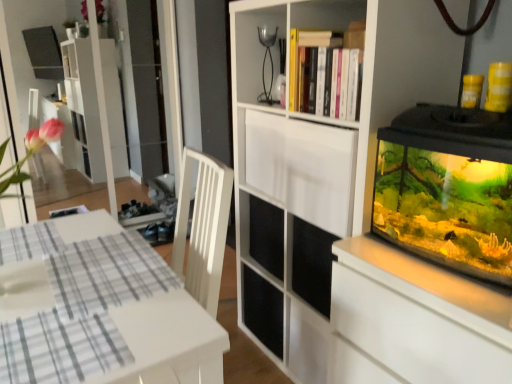
The width and height of the screenshot is (512, 384). What do you see at coordinates (165, 341) in the screenshot? I see `white glossy table at lower left` at bounding box center [165, 341].

At what (x,y) coordinates should I click in order to perform the action: click on white matte cupboard at center. Please return your answer as a coordinate pair (x, y). The width and height of the screenshot is (512, 384). Looking at the image, I should click on (356, 212).

Where is `white glossy table at lower left`? The height and width of the screenshot is (384, 512). white glossy table at lower left is located at coordinates (165, 341).

Based on their positions, is white glossy table at lower left located to the left or right of white matte cupboard at center?

From the image, it's evident that white glossy table at lower left is to the left of white matte cupboard at center.

From a real-world perspective, relative to white matte cupboard at center, is white glossy table at lower left vertically above or below?

From a real-world perspective, white glossy table at lower left is physically below white matte cupboard at center.

Considering the relative sizes of white glossy table at lower left and white matte cupboard at center in the image provided, is white glossy table at lower left taller than white matte cupboard at center?

In fact, white glossy table at lower left may be shorter than white matte cupboard at center.

Is white glossy table at lower left not within white matte cupboard at center?

That's correct, white glossy table at lower left is outside of white matte cupboard at center.

Based on their positions, is white matte cupboard at center located to the left or right of white glossy table at lower left?

Based on their positions, white matte cupboard at center is located to the right of white glossy table at lower left.

Where is `cupboard above the white glossy table at lower left (from the image's perspective)`? This screenshot has width=512, height=384. cupboard above the white glossy table at lower left (from the image's perspective) is located at coordinates (356, 212).

In the image, is white matte cupboard at center positioned in front of or behind white glossy table at lower left?

white matte cupboard at center is behind white glossy table at lower left.

Looking at their sizes, would you say white matte cupboard at center is wider or thinner than white glossy table at lower left?

white matte cupboard at center is thinner than white glossy table at lower left.

Between white matte cupboard at center and white matte cabinet at upper center, which one has larger size?

white matte cupboard at center is bigger.

Looking at their sizes, would you say white matte cupboard at center is wider or thinner than white matte cabinet at upper center?

Considering their sizes, white matte cupboard at center looks broader than white matte cabinet at upper center.

Is the depth of white matte cupboard at center greater than that of white matte cabinet at upper center?

No, white matte cupboard at center is closer to the camera.

Is point (372, 328) positioned before point (265, 167)?

Yes, point (372, 328) is in front of point (265, 167).

Does white matte cabinet at upper center have a lesser height compared to white glossy table at lower left?

Yes, white matte cabinet at upper center is shorter than white glossy table at lower left.

Based on the photo, is white matte cabinet at upper center oriented away from white glossy table at lower left?

That's not correct — white matte cabinet at upper center is not looking away from white glossy table at lower left.

Locate an element on the screen. This screenshot has height=384, width=512. table that appears below the white matte cabinet at upper center (from the image's perspective) is located at coordinates (165, 341).

How many degrees apart are the facing directions of white matte cabinet at upper center and white glossy table at lower left?

2.77 degrees.

Which point is more distant from viewer, (267, 142) or (369, 374)?

The point (267, 142) is farther from the camera.

From the image's perspective, which is above, white matte cabinet at upper center or white matte cupboard at center?

white matte cabinet at upper center.

Is white matte cabinet at upper center with white matte cupboard at center?

No, white matte cabinet at upper center is not in contact with white matte cupboard at center.

Is white glossy table at lower left positioned far away from white matte cabinet at upper center?

Actually, white glossy table at lower left and white matte cabinet at upper center are a little close together.

Where is `cabinetry that is above the white glossy table at lower left (from the image's perspective)`? This screenshot has width=512, height=384. cabinetry that is above the white glossy table at lower left (from the image's perspective) is located at coordinates (303, 168).

Considering the points (192, 354) and (303, 200), which point is behind, point (192, 354) or point (303, 200)?

Positioned behind is point (303, 200).

Considering the sizes of objects white glossy table at lower left and white matte cabinet at upper center in the image provided, who is thinner, white glossy table at lower left or white matte cabinet at upper center?

With smaller width is white matte cabinet at upper center.

In order to click on cupboard above the white glossy table at lower left (from the image's perspective) in this screenshot , I will do click(x=356, y=212).

Locate an element on the screen. cupboard that is behind the white glossy table at lower left is located at coordinates (356, 212).

When comparing their distances from white glossy table at lower left, does white matte cupboard at center or white matte cabinet at upper center seem further?

Based on the image, white matte cupboard at center appears to be further to white glossy table at lower left.

Estimate the real-world distances between objects in this image. Which object is closer to white matte cupboard at center, white matte cabinet at upper center or white glossy table at lower left?

white matte cabinet at upper center is positioned closer to the anchor white matte cupboard at center.

Based on the photo, based on their spatial positions, is white glossy table at lower left or white matte cabinet at upper center further from white matte cupboard at center?

white glossy table at lower left lies further to white matte cupboard at center than the other object.

Based on their spatial positions, is white matte cupboard at center or white glossy table at lower left further from white matte cabinet at upper center?

white glossy table at lower left lies further to white matte cabinet at upper center than the other object.

Looking at this image, estimate the real-world distances between objects in this image. Which object is further from white matte cabinet at upper center, white glossy table at lower left or white matte cupboard at center?

The object further to white matte cabinet at upper center is white glossy table at lower left.

Looking at the image, which one is located closer to white glossy table at lower left, white matte cabinet at upper center or white matte cupboard at center?

Among the two, white matte cabinet at upper center is located nearer to white glossy table at lower left.

At what (x,y) coordinates should I click in order to perform the action: click on cupboard between white glossy table at lower left and white matte cabinet at upper center in the front-back direction. Please return your answer as a coordinate pair (x, y). Image resolution: width=512 pixels, height=384 pixels. Looking at the image, I should click on (356, 212).